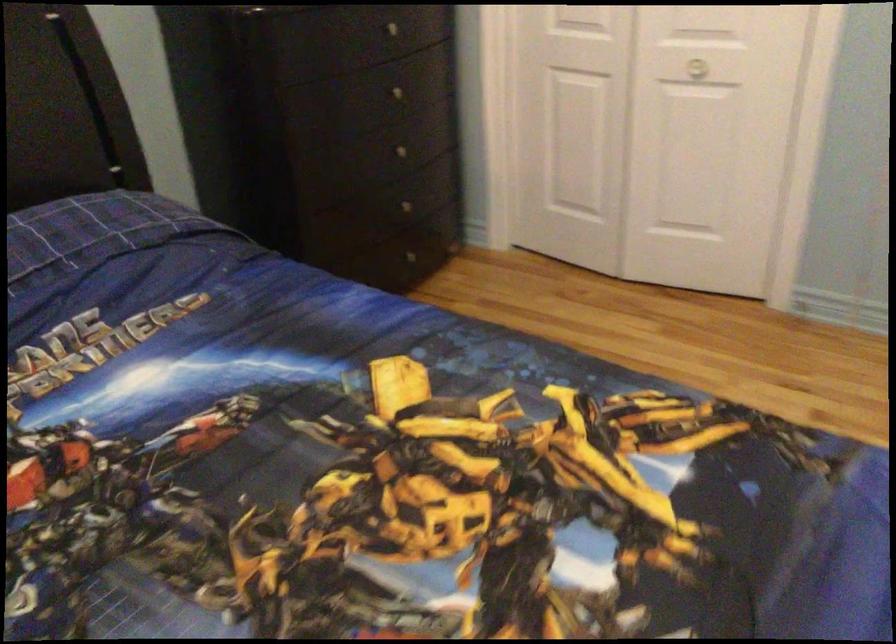
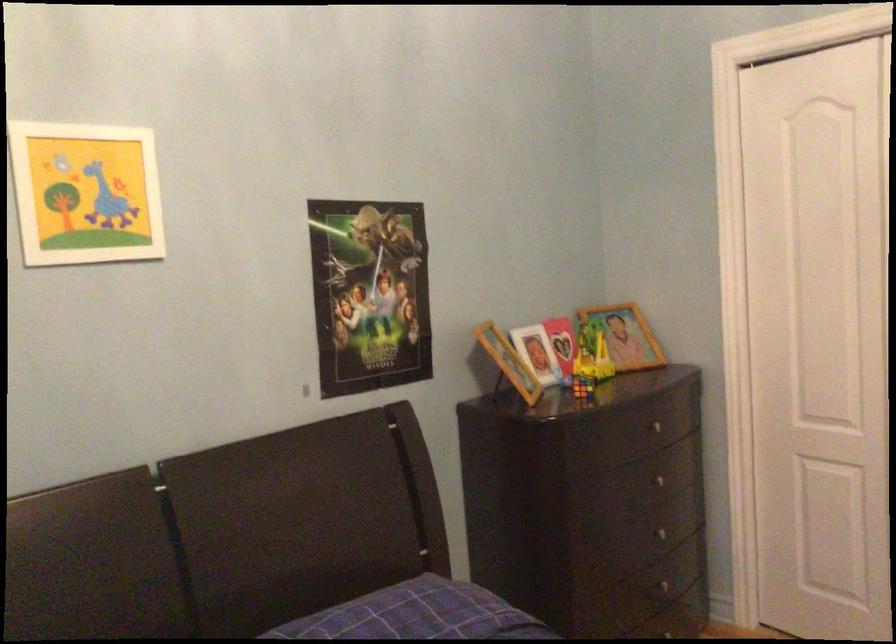
Where in the second image is the point corresponding to (x=402, y=146) from the first image?

(667, 532)